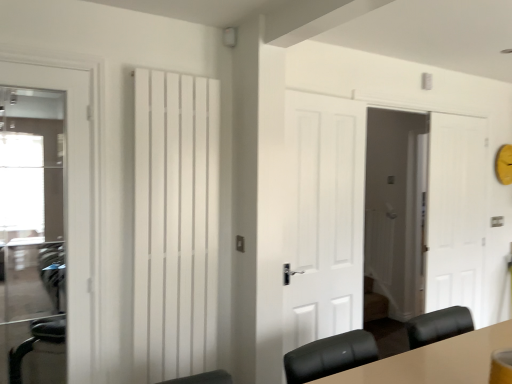
Question: Looking at their shapes, would you say white matte door at right, placed as the 4th door when sorted from front to back, is wider or thinner than white matte door at center, positioned as the 3th door in back-to-front order?

Choices:
 (A) wide
 (B) thin

Answer: (B)

Question: From a real-world perspective, is white matte door at right, marked as the fourth door in a left-to-right arrangement, above or below white matte door at center, arranged as the second door when viewed from the left?

Choices:
 (A) above
 (B) below

Answer: (B)

Question: Estimate the real-world distances between objects in this image. Which object is closer to the white matte door at center, arranged as the second door when viewed from the left?

Choices:
 (A) white matte door at right, the 1th door viewed from the right
 (B) white glossy door at left, which is counted as the fourth door, starting from the right
 (C) white matte radiator at center
 (D) white matte door at center, which is counted as the 3th door, starting from the front

Answer: (C)

Question: Estimate the real-world distances between objects in this image. Which object is farther from the white matte door at center, which is counted as the 2th door, starting from the back?

Choices:
 (A) white matte door at center, positioned as the 3th door in back-to-front order
 (B) white matte radiator at center
 (C) white glossy door at left, which ranks as the first door in front-to-back order
 (D) white matte door at right, the 1th door viewed from the right

Answer: (C)